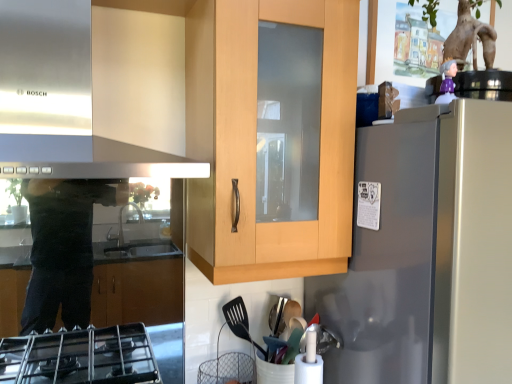
Question: Is stainless steel exhaust hood at upper left inside the boundaries of satin silver refrigerator at right, or outside?

Choices:
 (A) outside
 (B) inside

Answer: (A)

Question: Looking at their shapes, would you say stainless steel exhaust hood at upper left is wider or thinner than satin silver refrigerator at right?

Choices:
 (A) thin
 (B) wide

Answer: (A)

Question: Does point (165, 157) appear closer or farther from the camera than point (416, 336)?

Choices:
 (A) farther
 (B) closer

Answer: (B)

Question: Is satin silver refrigerator at right wider or thinner than stainless steel exhaust hood at upper left?

Choices:
 (A) wide
 (B) thin

Answer: (A)

Question: Is satin silver refrigerator at right situated inside stainless steel exhaust hood at upper left or outside?

Choices:
 (A) outside
 (B) inside

Answer: (A)

Question: From the image's perspective, is satin silver refrigerator at right above or below stainless steel exhaust hood at upper left?

Choices:
 (A) above
 (B) below

Answer: (B)

Question: Visually, is satin silver refrigerator at right positioned to the left or to the right of stainless steel exhaust hood at upper left?

Choices:
 (A) right
 (B) left

Answer: (A)